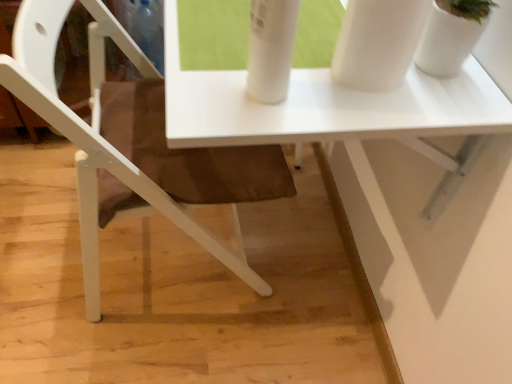
Question: Which is correct: white glossy table at center is inside white glossy vase at upper right, or outside of it?

Choices:
 (A) outside
 (B) inside

Answer: (A)

Question: Is white glossy table at center taller or shorter than white glossy vase at upper right?

Choices:
 (A) short
 (B) tall

Answer: (B)

Question: Estimate the real-world distances between objects in this image. Which object is closer to the white glossy table at center?

Choices:
 (A) white glossy vase at upper right
 (B) white matte chair at lower left

Answer: (B)

Question: Based on their relative distances, which object is farther from the white glossy table at center?

Choices:
 (A) white matte chair at lower left
 (B) white glossy vase at upper right

Answer: (B)